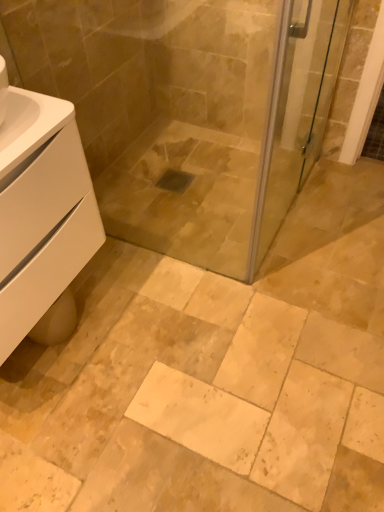
What do you see at coordinates (297, 110) in the screenshot? I see `transparent glass screen door at upper right` at bounding box center [297, 110].

Identify the location of transparent glass screen door at upper right. The height and width of the screenshot is (512, 384). (297, 110).

The width and height of the screenshot is (384, 512). Describe the element at coordinates (41, 216) in the screenshot. I see `white matte cabinet at lower left` at that location.

I want to click on white matte cabinet at lower left, so click(41, 216).

Find the location of a particular element. The image size is (384, 512). transparent glass screen door at upper right is located at coordinates (297, 110).

Based on their positions, is transparent glass screen door at upper right located to the left or right of white matte cabinet at lower left?

Clearly, transparent glass screen door at upper right is on the right of white matte cabinet at lower left in the image.

Is transparent glass screen door at upper right positioned before white matte cabinet at lower left?

No, it is behind white matte cabinet at lower left.

Does point (277, 63) come closer to viewer compared to point (19, 194)?

No, (277, 63) is further to viewer.

From the image's perspective, would you say transparent glass screen door at upper right is shown under white matte cabinet at lower left?

No.

From a real-world perspective, is transparent glass screen door at upper right located higher than white matte cabinet at lower left?

No, from a real-world perspective, transparent glass screen door at upper right is not above white matte cabinet at lower left.

Which of these two, transparent glass screen door at upper right or white matte cabinet at lower left, is wider?

Wider between the two is white matte cabinet at lower left.

Looking at this image, is transparent glass screen door at upper right shorter than white matte cabinet at lower left?

No.

Between transparent glass screen door at upper right and white matte cabinet at lower left, which one has larger size?

white matte cabinet at lower left is bigger.

Which is correct: transparent glass screen door at upper right is inside white matte cabinet at lower left, or outside of it?

transparent glass screen door at upper right is located beyond the bounds of white matte cabinet at lower left.

Are transparent glass screen door at upper right and white matte cabinet at lower left located far from each other?

Actually, transparent glass screen door at upper right and white matte cabinet at lower left are a little close together.

Is transparent glass screen door at upper right oriented away from white matte cabinet at lower left?

No, transparent glass screen door at upper right is not facing away from white matte cabinet at lower left.

How different are the orientations of transparent glass screen door at upper right and white matte cabinet at lower left in degrees?

0.546 degrees.

From the picture: How much distance is there between transparent glass screen door at upper right and white matte cabinet at lower left?

transparent glass screen door at upper right is 28.77 inches away from white matte cabinet at lower left.

I want to click on screen door directly beneath the white matte cabinet at lower left (from a real-world perspective), so click(x=297, y=110).

Between white matte cabinet at lower left and transparent glass screen door at upper right, which one appears on the left side from the viewer's perspective?

white matte cabinet at lower left.

Considering their positions, is white matte cabinet at lower left located in front of or behind transparent glass screen door at upper right?

Clearly, white matte cabinet at lower left is in front of transparent glass screen door at upper right.

Which is behind, point (42, 254) or point (296, 56)?

Positioned behind is point (296, 56).

From the image's perspective, is white matte cabinet at lower left positioned above or below transparent glass screen door at upper right?

Clearly, from the image's perspective, white matte cabinet at lower left is below transparent glass screen door at upper right.

From a real-world perspective, who is located higher, white matte cabinet at lower left or transparent glass screen door at upper right?

white matte cabinet at lower left.

Considering the sizes of objects white matte cabinet at lower left and transparent glass screen door at upper right in the image provided, who is thinner, white matte cabinet at lower left or transparent glass screen door at upper right?

transparent glass screen door at upper right.

Is white matte cabinet at lower left taller or shorter than transparent glass screen door at upper right?

white matte cabinet at lower left is shorter than transparent glass screen door at upper right.

Considering the sizes of objects white matte cabinet at lower left and transparent glass screen door at upper right in the image provided, who is bigger, white matte cabinet at lower left or transparent glass screen door at upper right?

white matte cabinet at lower left.

Would you say white matte cabinet at lower left is inside or outside transparent glass screen door at upper right?

white matte cabinet at lower left is outside transparent glass screen door at upper right.

Would you consider white matte cabinet at lower left to be distant from transparent glass screen door at upper right?

Actually, white matte cabinet at lower left and transparent glass screen door at upper right are a little close together.

Is white matte cabinet at lower left oriented away from transparent glass screen door at upper right?

No, white matte cabinet at lower left's orientation is not away from transparent glass screen door at upper right.

How distant is white matte cabinet at lower left from transparent glass screen door at upper right?

A distance of 28.77 inches exists between white matte cabinet at lower left and transparent glass screen door at upper right.

You are a GUI agent. You are given a task and a screenshot of the screen. Output one action in this format:
    pyautogui.click(x=<x>, y=<y>)
    Task: Click on the bathroom cabinet that is in front of the transparent glass screen door at upper right
    This screenshot has height=512, width=384.
    Given the screenshot: What is the action you would take?
    pyautogui.click(x=41, y=216)

Identify the location of screen door beneath the white matte cabinet at lower left (from a real-world perspective). The width and height of the screenshot is (384, 512). (297, 110).

Find the location of a particular element. bathroom cabinet lying in front of the transparent glass screen door at upper right is located at coordinates (41, 216).